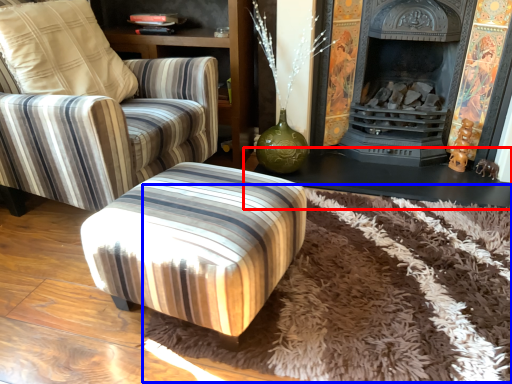
Question: Which object appears closest to the camera in this image, table (highlighted by a red box) or mat (highlighted by a blue box)?

Choices:
 (A) table
 (B) mat

Answer: (B)